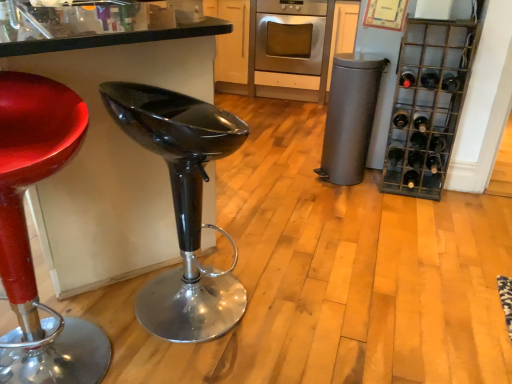
Question: Is stainless steel oven at center located within gray matte trash can at center-right?

Choices:
 (A) no
 (B) yes

Answer: (A)

Question: From the image's perspective, is gray matte trash can at center-right located above stainless steel oven at center?

Choices:
 (A) yes
 (B) no

Answer: (B)

Question: Is gray matte trash can at center-right outside stainless steel oven at center?

Choices:
 (A) yes
 (B) no

Answer: (A)

Question: Does gray matte trash can at center-right have a lesser height compared to stainless steel oven at center?

Choices:
 (A) no
 (B) yes

Answer: (B)

Question: From a real-world perspective, is gray matte trash can at center-right physically below stainless steel oven at center?

Choices:
 (A) no
 (B) yes

Answer: (B)

Question: Considering the relative sizes of gray matte trash can at center-right and stainless steel oven at center in the image provided, is gray matte trash can at center-right smaller than stainless steel oven at center?

Choices:
 (A) no
 (B) yes

Answer: (B)

Question: Does black glass wine bottle at lower right, the 1th wine bottle from the bottom, come behind black glass bottle at right, positioned as the 8th wine bottle in top-to-bottom order?

Choices:
 (A) no
 (B) yes

Answer: (B)

Question: Is black glass wine bottle at lower right, the tenth wine bottle when ordered from top to bottom, outside black glass bottle at right, positioned as the 8th wine bottle in top-to-bottom order?

Choices:
 (A) no
 (B) yes

Answer: (B)

Question: Would you say black glass bottle at right, positioned as the 8th wine bottle in top-to-bottom order, is part of black glass wine bottle at lower right, the 1th wine bottle from the bottom,'s contents?

Choices:
 (A) no
 (B) yes

Answer: (A)

Question: Does black glass wine bottle at lower right, the 1th wine bottle from the bottom, appear on the left side of black glass bottle at right, positioned as the 8th wine bottle in top-to-bottom order?

Choices:
 (A) yes
 (B) no

Answer: (A)

Question: From the image's perspective, is black glass wine bottle at lower right, the 1th wine bottle from the bottom, on black glass bottle at right, positioned as the third wine bottle in bottom-to-top order?

Choices:
 (A) no
 (B) yes

Answer: (A)

Question: Is there a large distance between black glass wine bottle at lower right, the 1th wine bottle from the bottom, and black glass bottle at right, positioned as the third wine bottle in bottom-to-top order?

Choices:
 (A) yes
 (B) no

Answer: (B)

Question: Is shiny red stool at left positioned with its back to dark green glass bottle at right, which ranks as the 9th wine bottle in bottom-to-top order?

Choices:
 (A) no
 (B) yes

Answer: (A)